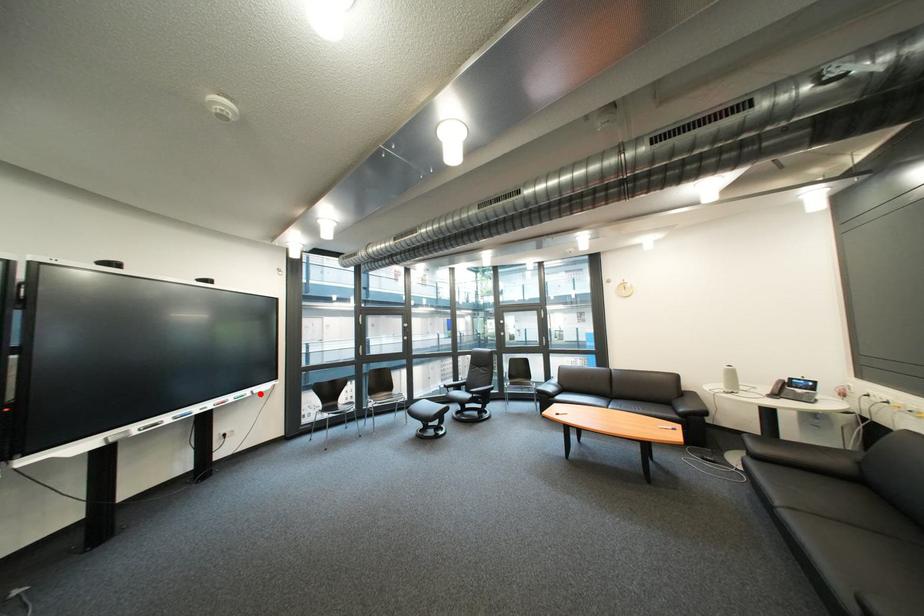
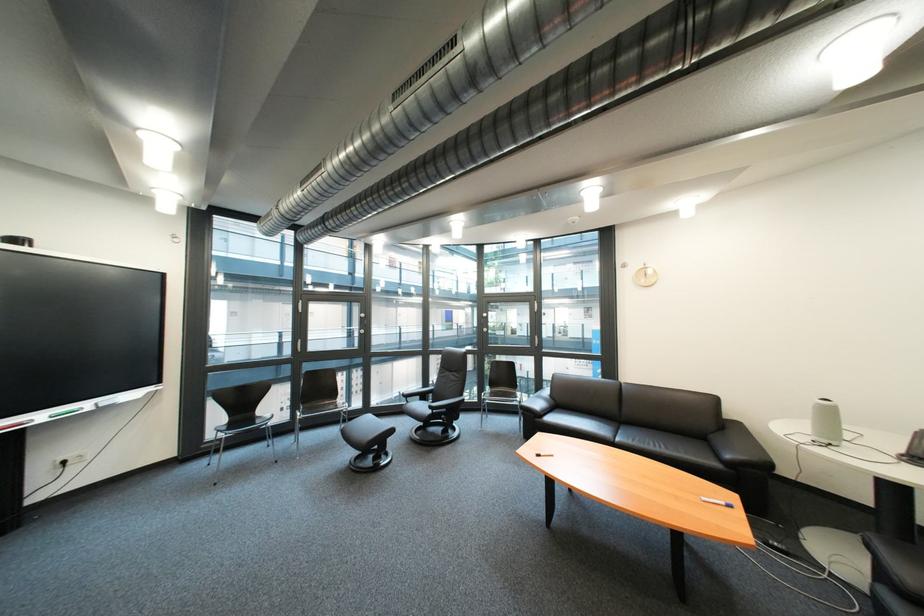
Question: I am providing you with two images of the same scene from different viewpoints. A red point is marked on the first image. Is the red point's position out of view in image 2?

Choices:
 (A) Yes
 (B) No

Answer: (B)